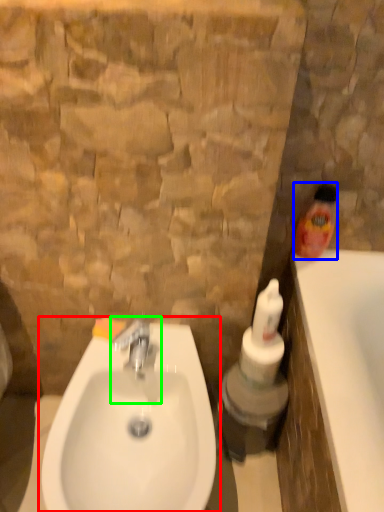
Question: Which is farther away from sink (highlighted by a red box)? cleaning product (highlighted by a blue box) or tap (highlighted by a green box)?

Choices:
 (A) cleaning product
 (B) tap

Answer: (A)